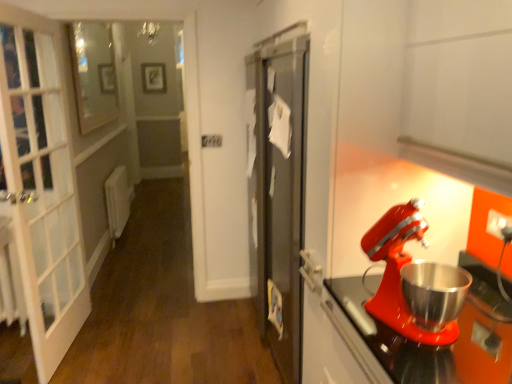
This screenshot has height=384, width=512. What do you see at coordinates (93, 74) in the screenshot?
I see `clear glass window at upper left` at bounding box center [93, 74].

What is the approximate width of matte black picture frame at upper center?

matte black picture frame at upper center is 1.93 inches wide.

Where is `clear glass window at upper left`? This screenshot has height=384, width=512. clear glass window at upper left is located at coordinates (93, 74).

The image size is (512, 384). What are the coordinates of `window located behind the matte red mixer at right` in the screenshot? It's located at 93,74.

How many degrees apart are the facing directions of matte red mixer at right and clear glass window at upper left?

matte red mixer at right and clear glass window at upper left are facing 164 degrees away from each other.

Is matte red mixer at right in front of or behind clear glass window at upper left in the image?

matte red mixer at right is positioned closer to the viewer than clear glass window at upper left.

Do you think matte red mixer at right is within clear glass window at upper left, or outside of it?

matte red mixer at right is outside clear glass window at upper left.

From a real-world perspective, which is physically above, matte red mixer at right or matte black picture frame at upper center?

matte black picture frame at upper center.

Between point (387, 311) and point (161, 67), which one is positioned behind?

The point (161, 67) is behind.

Is matte red mixer at right behind matte black picture frame at upper center?

That is False.

Is matte red mixer at right beside matte black picture frame at upper center?

No, matte red mixer at right is not next to matte black picture frame at upper center.

Identify the location of window located on the left of matte red mixer at right. Image resolution: width=512 pixels, height=384 pixels. (93, 74).

Does clear glass window at upper left touch matte red mixer at right?

No, clear glass window at upper left is not next to matte red mixer at right.

From the image's perspective, which is above, clear glass window at upper left or matte red mixer at right?

clear glass window at upper left appears higher in the image.

From the image's perspective, which object appears higher, clear glass window at upper left or matte black picture frame at upper center?

matte black picture frame at upper center is shown above in the image.

Between clear glass window at upper left and matte black picture frame at upper center, which one has larger size?

clear glass window at upper left.

Does point (115, 111) appear closer or farther from the camera than point (146, 78)?

Clearly, point (115, 111) is closer to the camera than point (146, 78).

What's the angular difference between clear glass window at upper left and matte black picture frame at upper center's facing directions?

90.2 degrees.

Is matte black picture frame at upper center not inside clear glass window at upper left?

Yes.

In the image, is matte black picture frame at upper center positioned in front of or behind clear glass window at upper left?

In the image, matte black picture frame at upper center appears behind clear glass window at upper left.

In the scene shown: Are matte black picture frame at upper center and clear glass window at upper left beside each other?

No, matte black picture frame at upper center is not with clear glass window at upper left.

Is matte black picture frame at upper center aimed at clear glass window at upper left?

Yes, matte black picture frame at upper center faces towards clear glass window at upper left.

Is matte black picture frame at upper center not within matte red mixer at right?

Indeed, matte black picture frame at upper center is completely outside matte red mixer at right.

This screenshot has height=384, width=512. In order to click on mixer below the matte black picture frame at upper center (from the image's perspective) in this screenshot , I will do `click(399, 271)`.

Is matte black picture frame at upper center far away from matte red mixer at right?

That's right, there is a large distance between matte black picture frame at upper center and matte red mixer at right.

From the image's perspective, between matte black picture frame at upper center and matte red mixer at right, who is located below?

matte red mixer at right.

This screenshot has height=384, width=512. In order to click on mixer below the clear glass window at upper left (from the image's perspective) in this screenshot , I will do `click(399, 271)`.

I want to click on picture frame on the left of matte red mixer at right, so click(x=154, y=77).

Based on their spatial positions, is matte red mixer at right or matte black picture frame at upper center further from clear glass window at upper left?

Based on the image, matte red mixer at right appears to be further to clear glass window at upper left.

Estimate the real-world distances between objects in this image. Which object is further from matte black picture frame at upper center, matte red mixer at right or clear glass window at upper left?

matte red mixer at right.

Based on their spatial positions, is matte black picture frame at upper center or clear glass window at upper left further from matte red mixer at right?

The object further to matte red mixer at right is matte black picture frame at upper center.

When comparing their distances from clear glass window at upper left, does matte black picture frame at upper center or matte red mixer at right seem closer?

matte black picture frame at upper center lies closer to clear glass window at upper left than the other object.

Considering their positions, is clear glass window at upper left positioned further to matte red mixer at right than matte black picture frame at upper center?

matte black picture frame at upper center.

Looking at the image, which one is located closer to matte black picture frame at upper center, clear glass window at upper left or matte red mixer at right?

The object closer to matte black picture frame at upper center is clear glass window at upper left.

Locate an element on the screen. The image size is (512, 384). window positioned between matte red mixer at right and matte black picture frame at upper center from near to far is located at coordinates (93, 74).